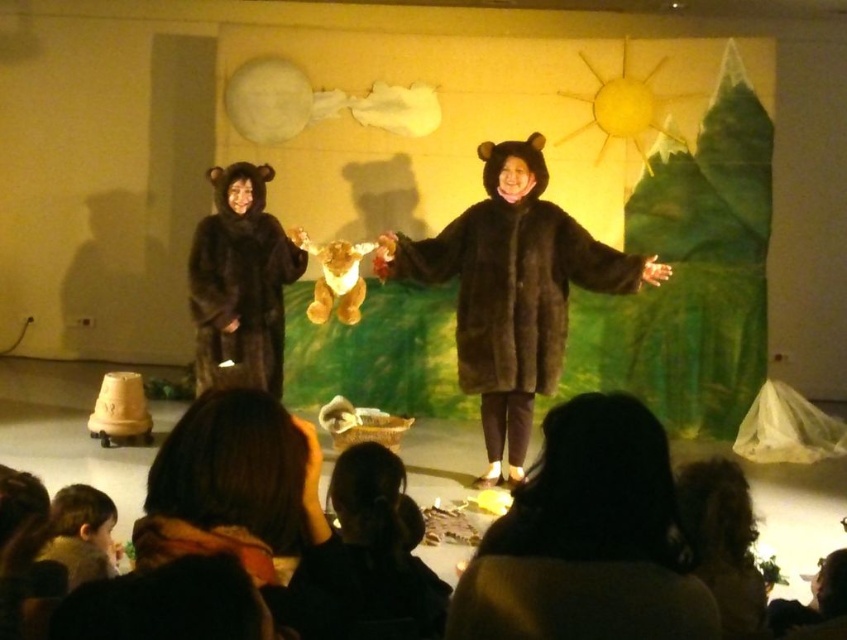
You are sitting in the audience watching the stage performance. You notice two performers in brown fur coats. Which one is positioned more to the left side of the stage? The performers are the matte brown fur coat at center and the dark brown fur coat at lower center.

The matte brown fur coat at center is positioned more to the left side of the stage compared to the dark brown fur coat at lower center.

You are a stagehand preparing to place a 1.2 meter wide banner between the black fuzzy coat at lower center and the dark brown hair at lower right. Can the banner fit between them based on their widths?

The black fuzzy coat at lower center is narrower than the dark brown hair at lower right. However, the total width between them isn not provided, so we can only compare their individual widths. Since the banner requires 1.2 meters, but we don know the actual space between them, it might not fit. More info needed.

In the scene shown: Based on the provided scene description, where is the matte brown fur coat at center located in terms of its 2D coordinates?

The matte brown fur coat at center is located at the 2D coordinates point (x=438, y=173).